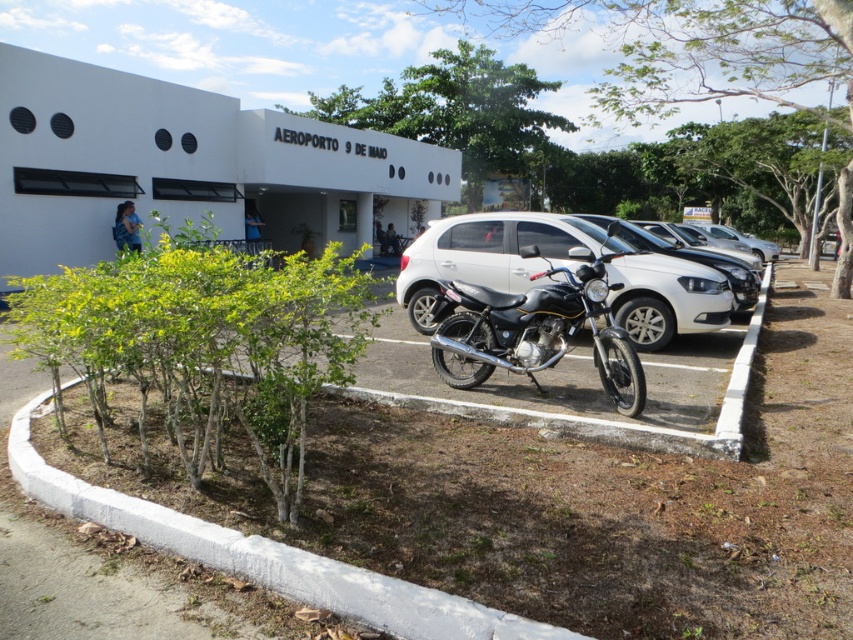
You are standing at the entrance of AEROPORTO 9 DE MAIO and want to take a photo of both the black matte motorcycle at center and the glossy white sedan at center. Which vehicle should you focus on first to ensure both are in frame?

You should focus on the black matte motorcycle at center first because it is closer to you than the glossy white sedan at center, ensuring both are in frame.

You are standing at the entrance of AEROPORTO 9 DE MAIO and want to park your vehicle. If you want to park your car behind the satin white car at center, where should you position your vehicle relative to the black matte motorcycle at center?

The satin white car at center is located above the black matte motorcycle at center, so to park behind the satin white car at center, you should position your vehicle behind the black matte motorcycle at center as well.

You are a delivery person who needs to park your van between the black matte motorcycle at center and the glossy white sedan at center. The van is 14 feet long. Can you fit your van between them?

The distance between the black matte motorcycle at center and the glossy white sedan at center is 13.80 feet, which is slightly shorter than the van. Therefore, the van cannot fit between them.